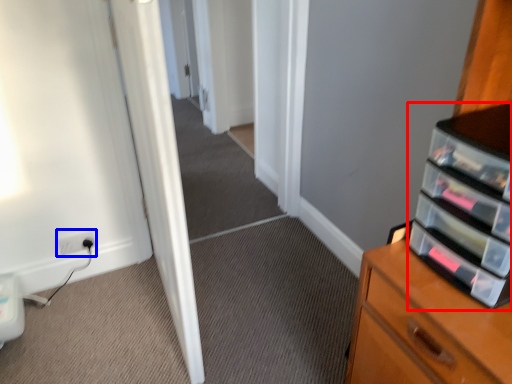
Question: Among these objects, which one is nearest to the camera, shelf (highlighted by a red box) or electric outlet (highlighted by a blue box)?

Choices:
 (A) shelf
 (B) electric outlet

Answer: (A)